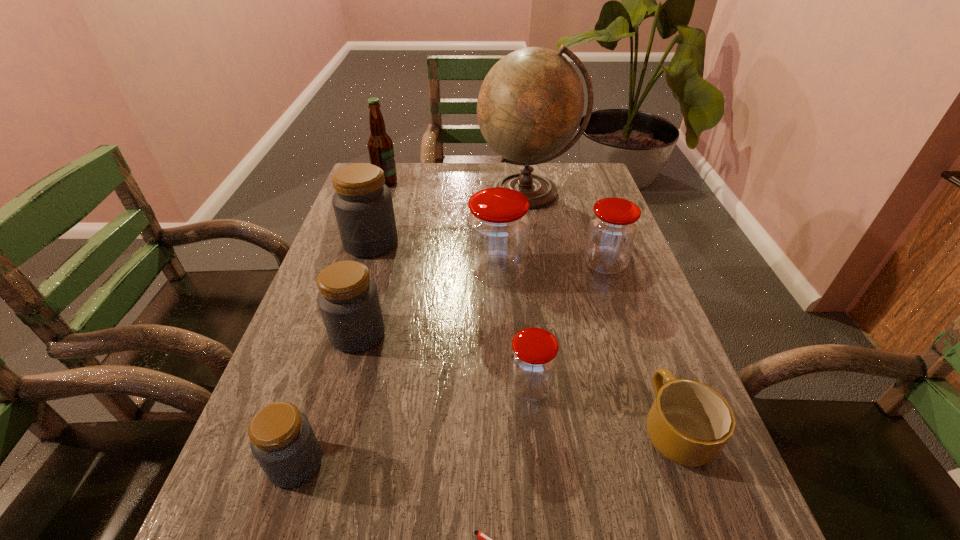
The height and width of the screenshot is (540, 960). I want to click on free space located on the surface of the fifth nearest object near the warning symbol, so click(339, 402).

The image size is (960, 540). Find the location of `free region located 0.230m on the front of the nearest red jar`. free region located 0.230m on the front of the nearest red jar is located at coordinates [545, 534].

The image size is (960, 540). In order to click on vacant space located on the surface of the smallest gray jar near the warning symbol in this screenshot , I will do `click(457, 463)`.

This screenshot has height=540, width=960. Identify the location of vacant space located on the side with the handle of the tan mug. (633, 313).

Where is `vacant space located on the side with the handle of the tan mug`? vacant space located on the side with the handle of the tan mug is located at coordinates (629, 304).

Locate an element on the screen. free space located on the side with the handle of the tan mug is located at coordinates pos(623,288).

Where is `globe that is at the far edge`? globe that is at the far edge is located at coordinates (531, 102).

Where is `beer bottle at the far edge`? beer bottle at the far edge is located at coordinates coord(380,146).

Locate an element on the screen. The height and width of the screenshot is (540, 960). beer bottle present at the left edge is located at coordinates (380, 146).

I want to click on globe present at the right edge, so click(x=531, y=102).